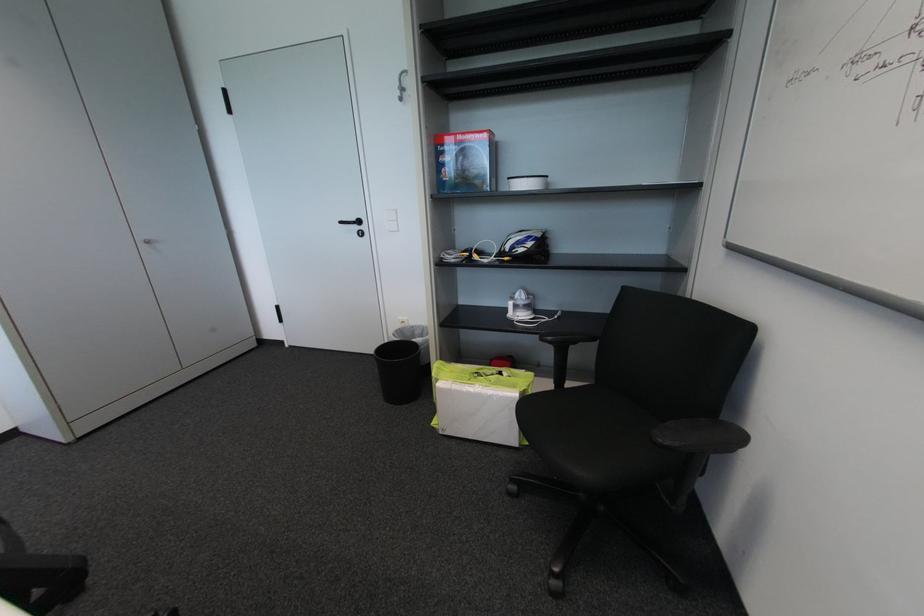
Where would you press the white light switch? Please return your answer as a coordinate pair (x, y).

(392, 220)